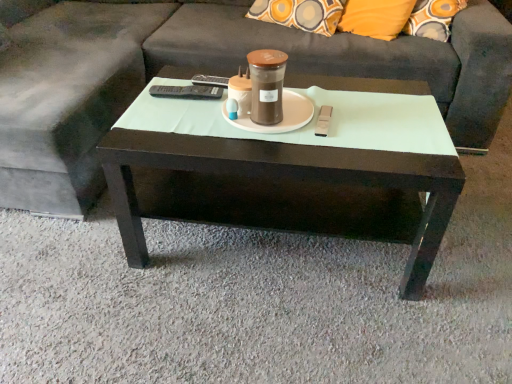
The height and width of the screenshot is (384, 512). I want to click on unoccupied area in front of brown matte jar at center, so click(270, 145).